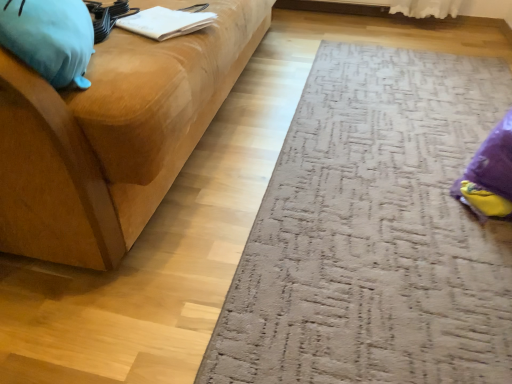
The width and height of the screenshot is (512, 384). Find the location of `free space above textured gray doormat at lower right (from a real-world perspective)`. free space above textured gray doormat at lower right (from a real-world perspective) is located at coordinates (391, 187).